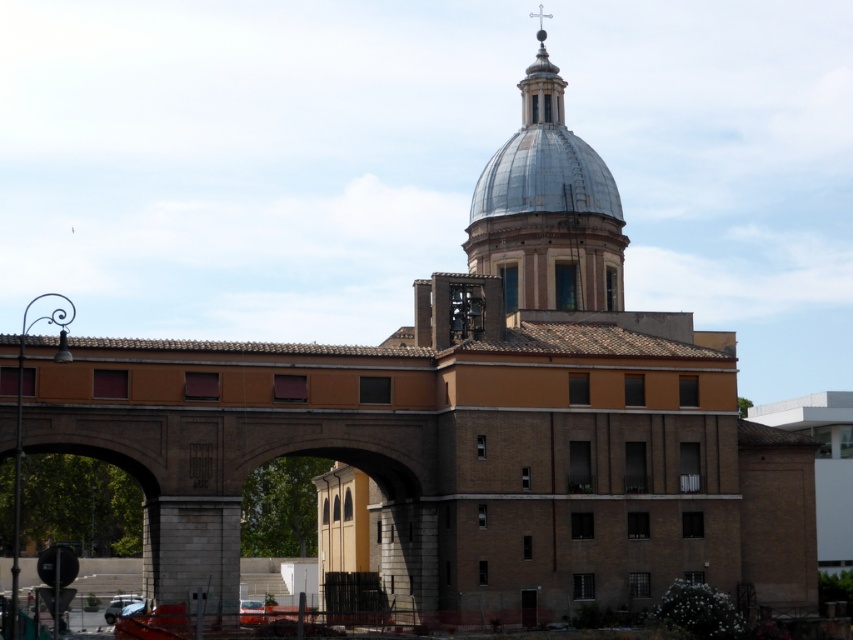
Who is lower down, shiny silver dome at upper center or shiny metallic dome at upper center?

shiny silver dome at upper center is below.

Can you confirm if shiny silver dome at upper center is smaller than shiny metallic dome at upper center?

No, shiny silver dome at upper center is not smaller than shiny metallic dome at upper center.

Is point (490, 161) positioned behind point (523, 129)?

No, (490, 161) is closer to viewer.

Find the location of a particular element. The height and width of the screenshot is (640, 853). shiny silver dome at upper center is located at coordinates (547, 209).